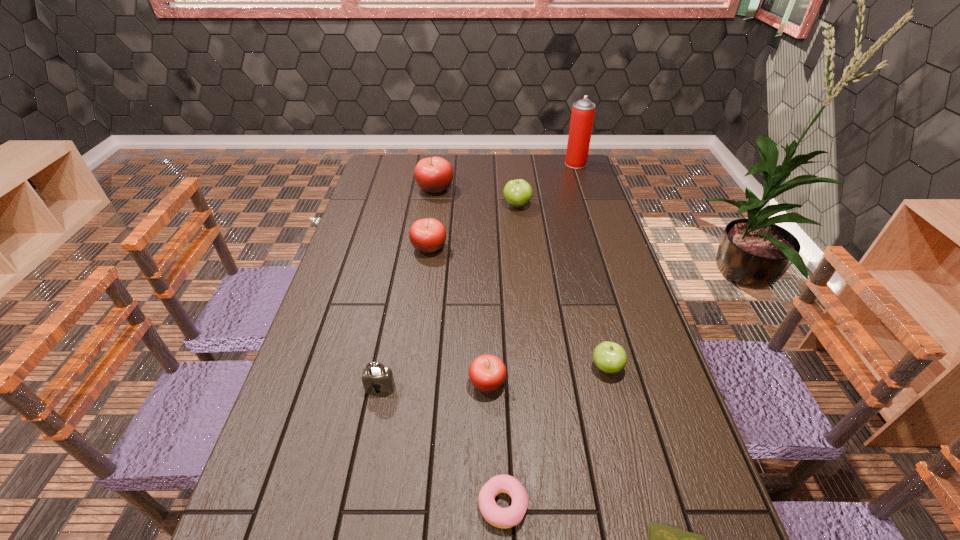
Where is `the farthest object`? the farthest object is located at coordinates (583, 111).

Where is `the tallest object`? Image resolution: width=960 pixels, height=540 pixels. the tallest object is located at coordinates tap(583, 111).

The width and height of the screenshot is (960, 540). In order to click on the farthest red apple in this screenshot , I will do `click(434, 175)`.

The width and height of the screenshot is (960, 540). Find the location of `the tallest apple`. the tallest apple is located at coordinates (434, 175).

I want to click on the left green apple, so click(517, 193).

This screenshot has width=960, height=540. What are the coordinates of `the fourth apple from left to right` in the screenshot? It's located at (517, 193).

Image resolution: width=960 pixels, height=540 pixels. In order to click on the fourth farthest object in this screenshot , I will do `click(428, 235)`.

I want to click on the third farthest apple, so click(x=428, y=235).

At what (x,y) coordinates should I click in order to perform the action: click on padlock. Please return your answer as a coordinate pair (x, y). The width and height of the screenshot is (960, 540). Looking at the image, I should click on (375, 374).

This screenshot has width=960, height=540. What are the coordinates of `the rightmost apple` in the screenshot? It's located at (609, 357).